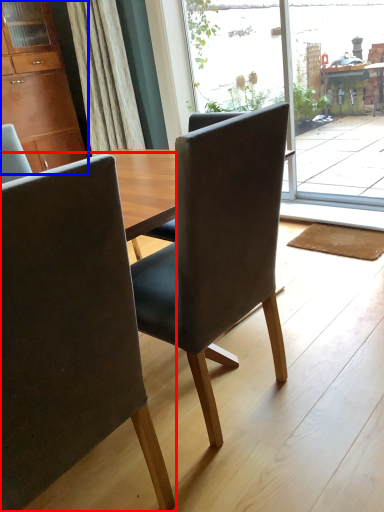
Question: Which point is further to the camera, chair (highlighted by a red box) or cabinetry (highlighted by a blue box)?

Choices:
 (A) chair
 (B) cabinetry

Answer: (B)